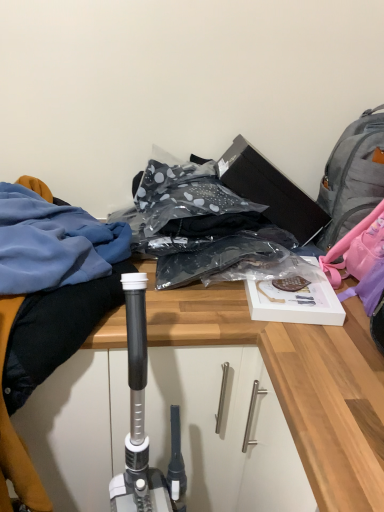
Question: Is gray fabric backpack at upper right directly adjacent to wooden desk at center?

Choices:
 (A) yes
 (B) no

Answer: (B)

Question: Would you say wooden desk at center is part of gray fabric backpack at upper right's contents?

Choices:
 (A) yes
 (B) no

Answer: (B)

Question: Is gray fabric backpack at upper right further to the viewer compared to wooden desk at center?

Choices:
 (A) yes
 (B) no

Answer: (A)

Question: Considering the relative sizes of gray fabric backpack at upper right and wooden desk at center in the image provided, is gray fabric backpack at upper right thinner than wooden desk at center?

Choices:
 (A) yes
 (B) no

Answer: (A)

Question: Could you tell me if gray fabric backpack at upper right is turned towards wooden desk at center?

Choices:
 (A) yes
 (B) no

Answer: (B)

Question: Considering their positions, is gray fabric backpack at upper right located in front of or behind blue fabric at left?

Choices:
 (A) behind
 (B) front

Answer: (A)

Question: Considering the positions of point (345, 219) and point (86, 317), is point (345, 219) closer or farther from the camera than point (86, 317)?

Choices:
 (A) closer
 (B) farther

Answer: (B)

Question: From the image's perspective, relative to blue fabric at left, is gray fabric backpack at upper right above or below?

Choices:
 (A) above
 (B) below

Answer: (A)

Question: From a real-world perspective, is gray fabric backpack at upper right positioned above or below blue fabric at left?

Choices:
 (A) below
 (B) above

Answer: (B)

Question: Which is correct: blue fabric at left is inside wooden desk at center, or outside of it?

Choices:
 (A) inside
 (B) outside

Answer: (B)

Question: Considering the positions of blue fabric at left and wooden desk at center in the image, is blue fabric at left taller or shorter than wooden desk at center?

Choices:
 (A) tall
 (B) short

Answer: (B)

Question: From the image's perspective, is blue fabric at left positioned above or below wooden desk at center?

Choices:
 (A) below
 (B) above

Answer: (B)

Question: In the image, is blue fabric at left positioned in front of or behind wooden desk at center?

Choices:
 (A) behind
 (B) front

Answer: (A)

Question: From a real-world perspective, is wooden desk at center physically located above or below blue fabric at left?

Choices:
 (A) above
 (B) below

Answer: (B)

Question: Visually, is wooden desk at center positioned to the left or to the right of blue fabric at left?

Choices:
 (A) left
 (B) right

Answer: (B)